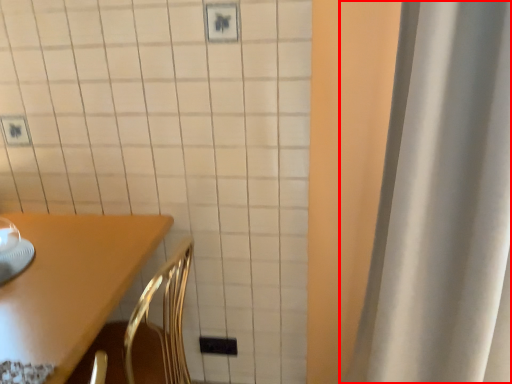
Question: Where is curtain (annotated by the red box) located in relation to furniture in the image?

Choices:
 (A) right
 (B) left

Answer: (A)